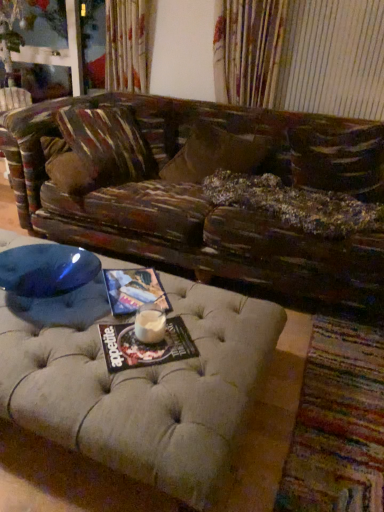
Question: Could you tell me if multicolored woven mat at lower right is turned towards matte paper magazine at center, acting as the 2th magazine starting from the front?

Choices:
 (A) yes
 (B) no

Answer: (B)

Question: Does multicolored woven mat at lower right lie in front of matte paper magazine at center, the 1th magazine viewed from the back?

Choices:
 (A) yes
 (B) no

Answer: (A)

Question: Is multicolored woven mat at lower right touching matte paper magazine at center, which is counted as the first magazine, starting from the top?

Choices:
 (A) no
 (B) yes

Answer: (A)

Question: Is multicolored woven mat at lower right further to camera compared to matte paper magazine at center, acting as the 2th magazine starting from the front?

Choices:
 (A) yes
 (B) no

Answer: (B)

Question: Can you confirm if multicolored woven mat at lower right is taller than matte paper magazine at center, which is counted as the first magazine, starting from the top?

Choices:
 (A) yes
 (B) no

Answer: (A)

Question: From the image's perspective, is multicolored woven mat at lower right on matte paper magazine at center, which is counted as the first magazine, starting from the top?

Choices:
 (A) no
 (B) yes

Answer: (A)

Question: Is multicolored woven mat at lower right thinner than white frothy liquid at center?

Choices:
 (A) yes
 (B) no

Answer: (B)

Question: Is multicolored woven mat at lower right oriented towards white frothy liquid at center?

Choices:
 (A) yes
 (B) no

Answer: (B)

Question: Is multicolored woven mat at lower right taller than white frothy liquid at center?

Choices:
 (A) no
 (B) yes

Answer: (A)

Question: Is multicolored woven mat at lower right positioned in front of white frothy liquid at center?

Choices:
 (A) no
 (B) yes

Answer: (B)

Question: Is multicolored woven mat at lower right to the right of white frothy liquid at center from the viewer's perspective?

Choices:
 (A) yes
 (B) no

Answer: (A)

Question: Is multicolored woven mat at lower right not close to white frothy liquid at center?

Choices:
 (A) yes
 (B) no

Answer: (B)

Question: Is the position of white frothy liquid at center more distant than that of distressed wood studio couch at center?

Choices:
 (A) no
 (B) yes

Answer: (B)